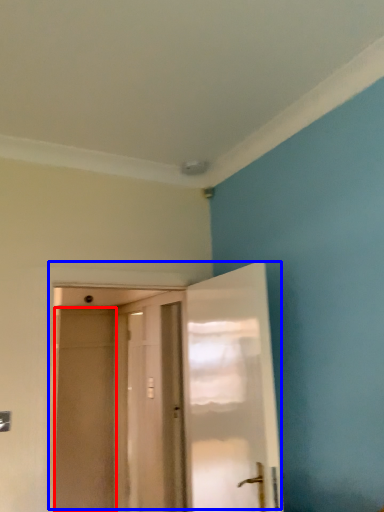
Question: Which object appears closest to the camera in this image, screen door (highlighted by a red box) or door (highlighted by a blue box)?

Choices:
 (A) screen door
 (B) door

Answer: (B)